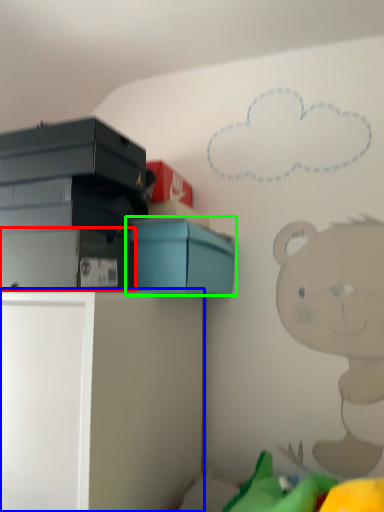
Question: Which is farther away from storage box (highlighted by a red box)? furniture (highlighted by a blue box) or box (highlighted by a green box)?

Choices:
 (A) furniture
 (B) box

Answer: (A)